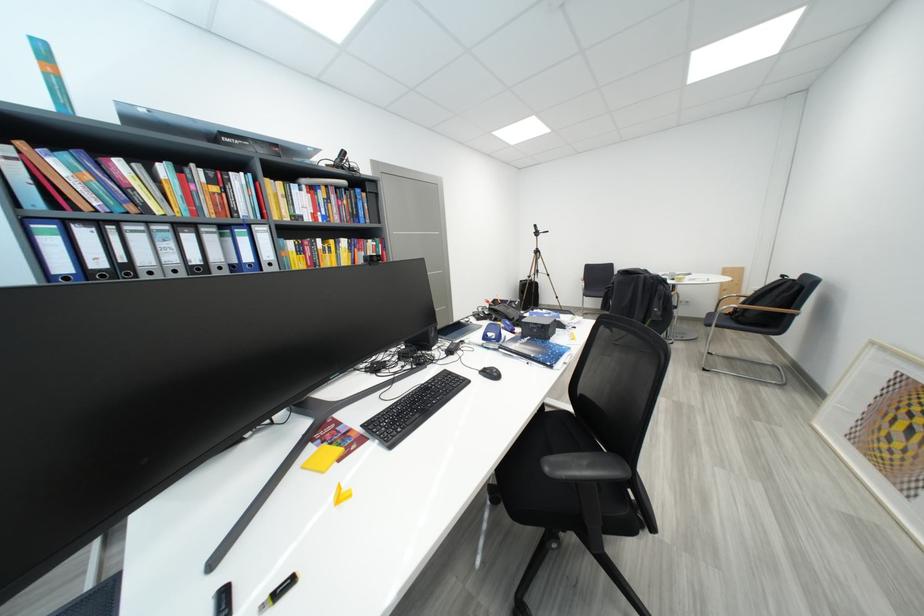
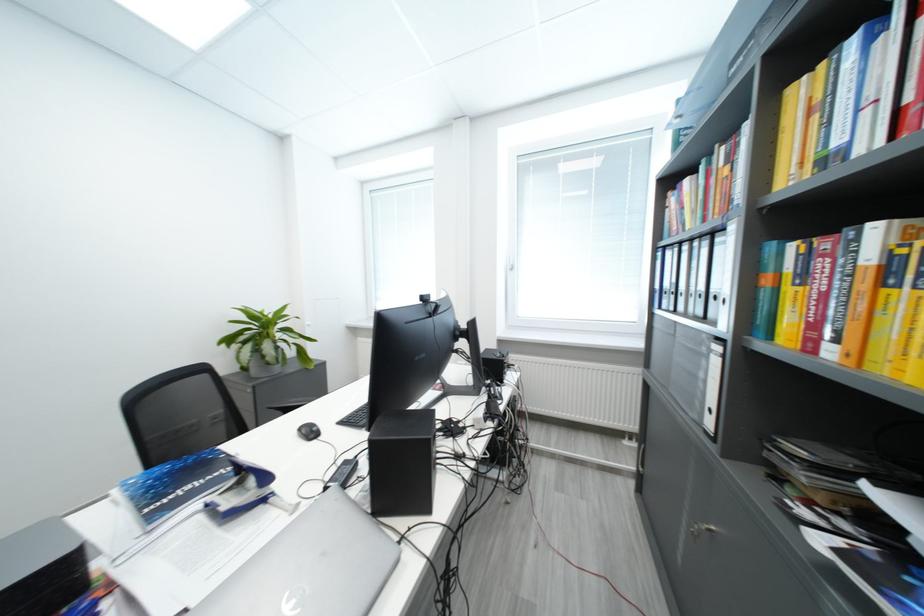
Question: I am providing you with two images of the same scene from different viewpoints. After the viewpoint changes to image2, which objects are now occluded?

Choices:
 (A) black speaker
 (B) chair sitting surface
 (C) potted plant
 (D) tooth mug

Answer: (B)